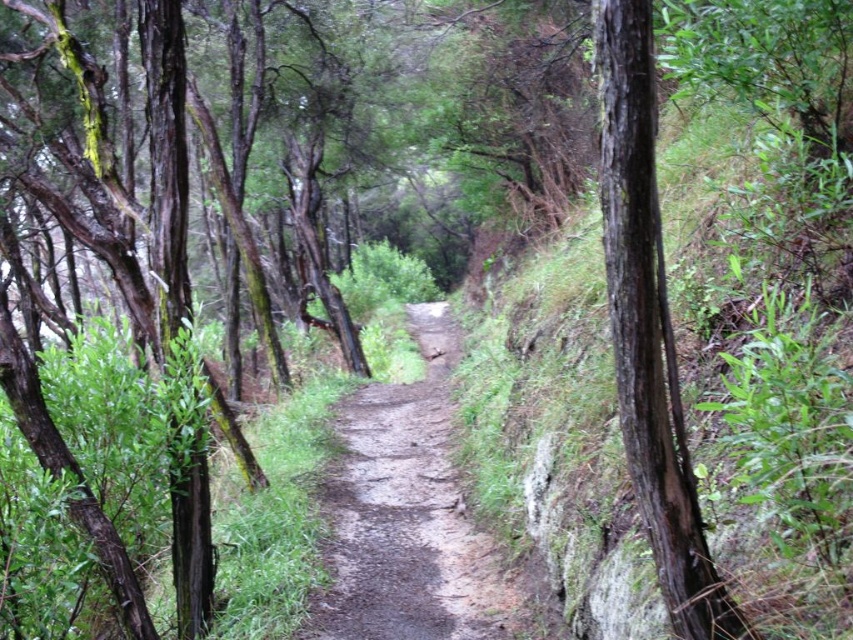
Is point (479, 628) behind point (650, 403)?

Yes, it is.

Is damp dirt path at center above dark brown bark tree at right?

No.

Is point (384, 625) closer to viewer compared to point (628, 280)?

No, (384, 625) is further to viewer.

In order to click on damp dirt path at center in this screenshot , I will do `click(408, 515)`.